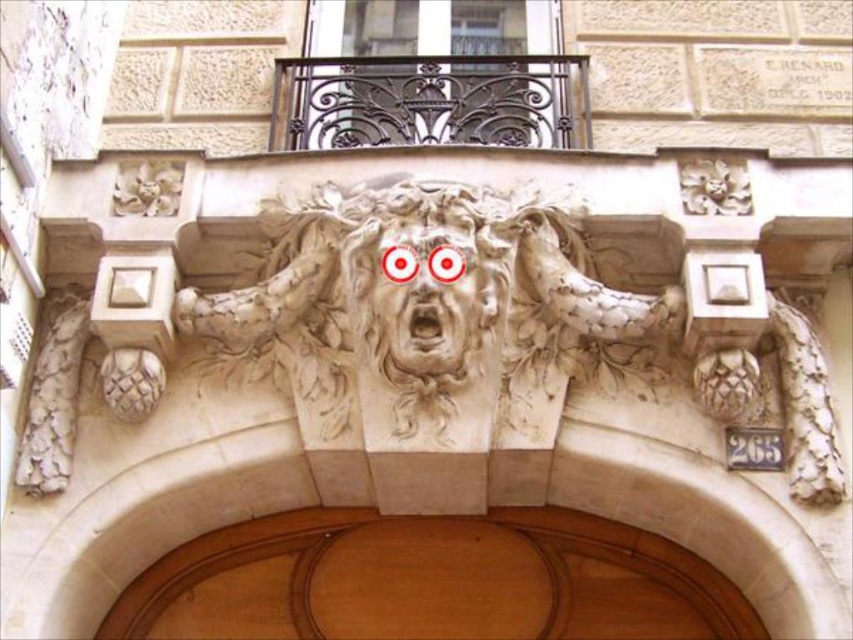
You are an architect examining the building facade. You notice the white stone lion at center and the carved stone face at center. Which object is positioned lower on the facade?

The white stone lion at center is positioned lower than the carved stone face at center.

You are a painter standing in front of the wooden door at center and the carved stone face at center. You need to paint both but only have enough paint for one. Which object should you choose based on their sizes?

The wooden door at center is larger than the carved stone face at center, so you should choose to paint the wooden door at center first since it requires more paint.

You are an architect examining the building facade. You see the white stone lion at center and the carved stone face at center. Which object is positioned to the right of the other?

The white stone lion at center is to the right of the carved stone face at center according to the description.